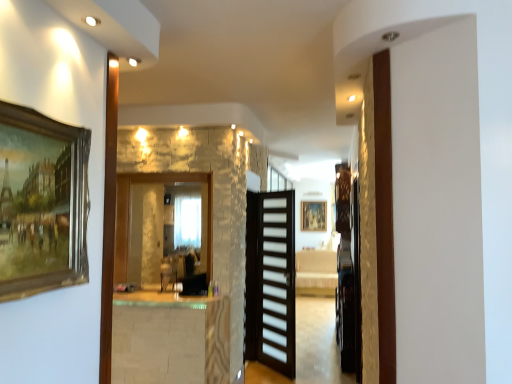
Question: Does white marble table at center have a lesser width compared to wooden picture frame at left?

Choices:
 (A) yes
 (B) no

Answer: (B)

Question: Is white marble table at center facing away from wooden picture frame at left?

Choices:
 (A) no
 (B) yes

Answer: (A)

Question: From the image's perspective, is white marble table at center located above wooden picture frame at left?

Choices:
 (A) no
 (B) yes

Answer: (A)

Question: Is the position of white marble table at center less distant than that of wooden picture frame at left?

Choices:
 (A) no
 (B) yes

Answer: (A)

Question: Is white marble table at center completely or partially outside of wooden picture frame at left?

Choices:
 (A) yes
 (B) no

Answer: (A)

Question: Considering the relative sizes of white marble table at center and wooden picture frame at left in the image provided, is white marble table at center bigger than wooden picture frame at left?

Choices:
 (A) yes
 (B) no

Answer: (A)

Question: From a real-world perspective, is clear glass mirror at center positioned under wooden picture frame at left based on gravity?

Choices:
 (A) yes
 (B) no

Answer: (A)

Question: Is clear glass mirror at center to the left of wooden picture frame at left from the viewer's perspective?

Choices:
 (A) no
 (B) yes

Answer: (B)

Question: Can you confirm if clear glass mirror at center is wider than wooden picture frame at left?

Choices:
 (A) yes
 (B) no

Answer: (A)

Question: Is clear glass mirror at center turned away from wooden picture frame at left?

Choices:
 (A) no
 (B) yes

Answer: (A)

Question: Considering the relative positions of clear glass mirror at center and wooden picture frame at left in the image provided, is clear glass mirror at center to the right of wooden picture frame at left from the viewer's perspective?

Choices:
 (A) no
 (B) yes

Answer: (A)

Question: From the image's perspective, does clear glass mirror at center appear higher than wooden picture frame at left?

Choices:
 (A) yes
 (B) no

Answer: (B)

Question: Is white marble table at center outside of clear glass mirror at center?

Choices:
 (A) no
 (B) yes

Answer: (B)